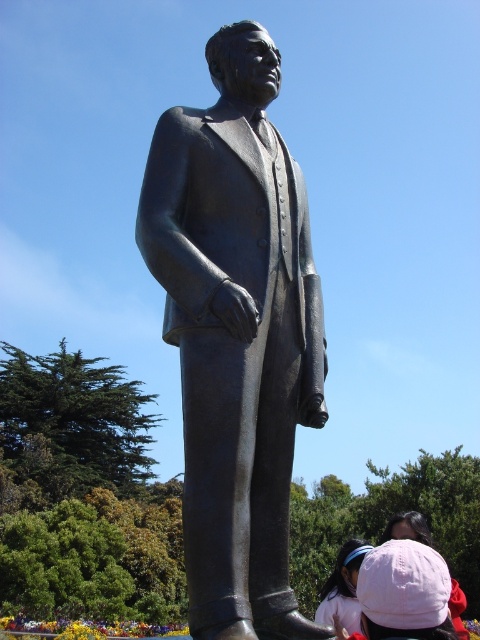
Looking at this image, you are a tour guide leading a group near the bronze statue. You notice two pink items at the lower right corner of your view. Your group asks if they can safely walk between them. The path between them is 13.13 feet wide. Your tour group has a member with a wheelchair that is 2.5 feet wide. Can they pass through the space between the pink fabric headband at lower right and the pink fabric hat at lower right?

The distance between the pink fabric headband at lower right and the pink fabric hat at lower right is 13.13 feet. Since the wheelchair is only 2.5 feet wide, there is more than enough space for the wheelchair to pass safely between them.

You are a tour guide explaining the statue to visitors. You want to point out the bronze statue at center and the pink fabric headband at lower right. How would you describe their spatial relationship?

The bronze statue at center is positioned in front of the pink fabric headband at lower right, meaning the statue is closer to the front while the headband is situated behind it.

Based on the photo, you are standing in front of the bronze statue and want to locate the pink fabric headband at lower right. According to the coordinates provided, where should you look relative to the statue?

You should look at the point located at 0.919 on the x axis and 0.715 on the y axis relative to the statue to find the pink fabric headband at lower right.